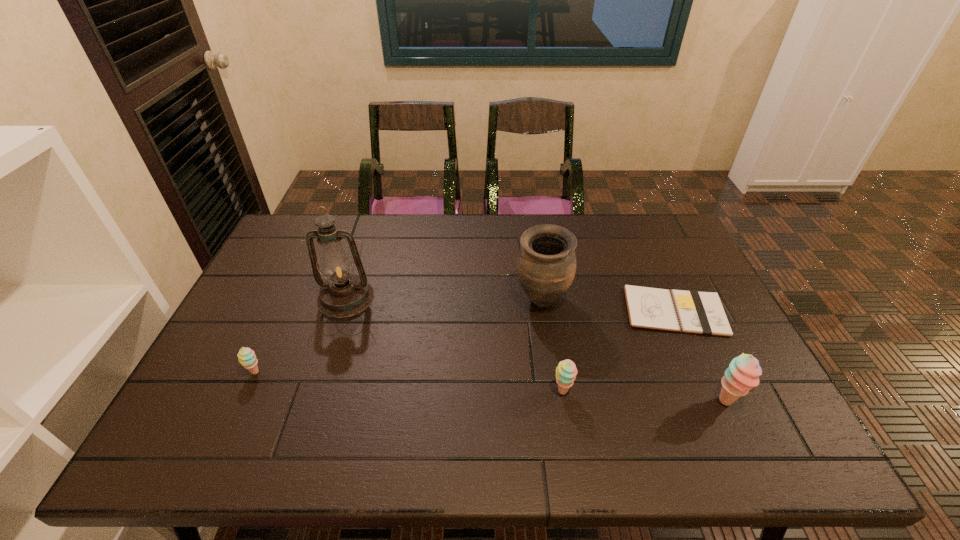
Find the location of a particular element. This screenshot has height=540, width=960. blank region between the leftmost object and the notepad is located at coordinates (465, 341).

This screenshot has height=540, width=960. Identify the location of vacant space in between the notepad and the tallest object. (511, 305).

Where is `unoccupied position between the shortest object and the fourth shortest object`? unoccupied position between the shortest object and the fourth shortest object is located at coordinates (700, 356).

Where is `free spot between the third tallest object and the oil lamp`? free spot between the third tallest object and the oil lamp is located at coordinates (536, 350).

Find the location of a particular element. This screenshot has height=540, width=960. free space between the leftmost object and the second tallest sherbert is located at coordinates (409, 382).

In order to click on blank region between the second tallest object and the shortest object in this screenshot , I will do `click(609, 306)`.

Locate an element on the screen. This screenshot has width=960, height=540. vacant space in between the farthest sherbert and the tallest object is located at coordinates (300, 335).

Locate which object ranks fifth in proximity to the second shortest object. Please provide its 2D coordinates. Your answer should be formatted as a tuple, i.e. [(x, y)], where the tuple contains the x and y coordinates of a point satisfying the conditions above.

[(743, 373)]

Image resolution: width=960 pixels, height=540 pixels. I want to click on object that ranks as the second closest to the fifth shortest object, so click(566, 371).

Image resolution: width=960 pixels, height=540 pixels. In order to click on the closest sherbert relative to the rightmost sherbert in this screenshot , I will do `click(566, 371)`.